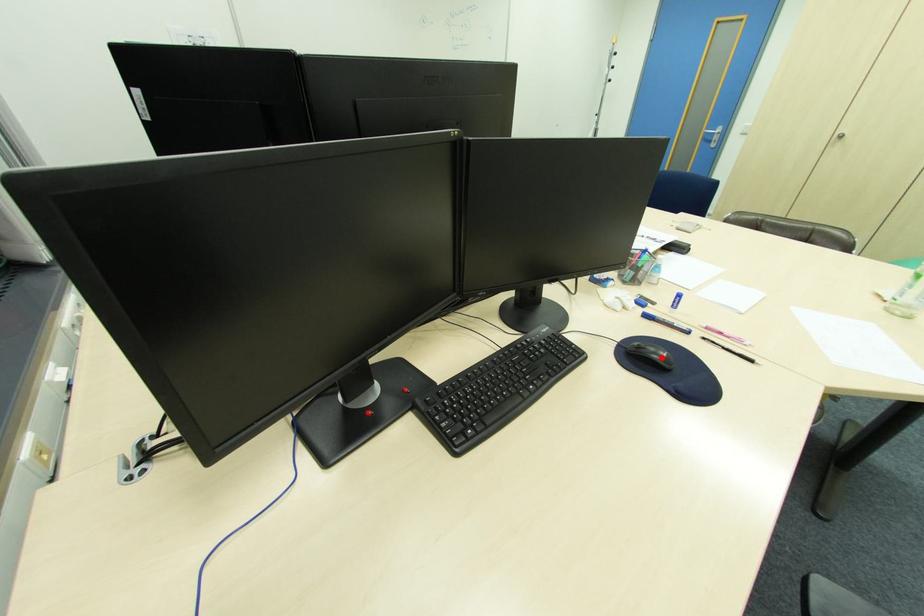
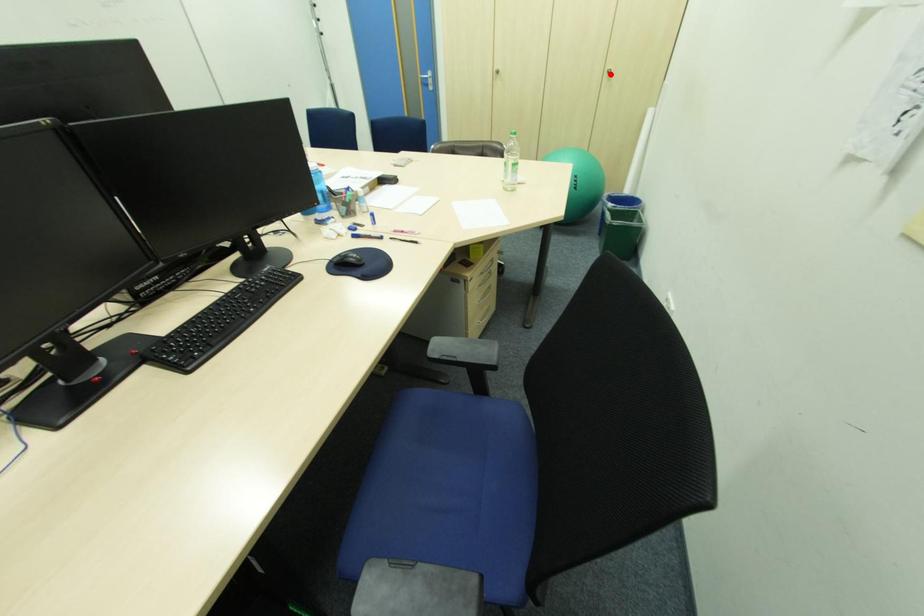
I am providing you with two images of the same scene from different viewpoints. A red point is marked on the first image and another point is marked on the second image. Are the points marked in image1 and image2 representing the same 3D position?

No